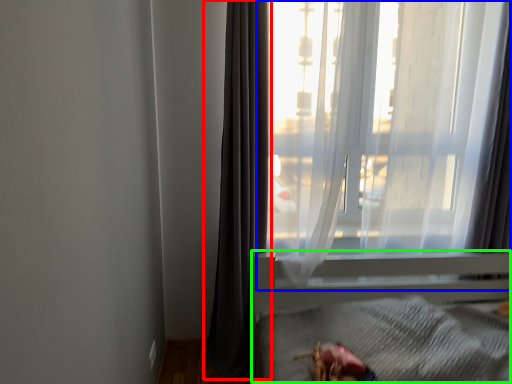
Question: Which object is the closest to the curtain (highlighted by a red box)? Choose among these: window (highlighted by a blue box) or bed frame (highlighted by a green box).

Choices:
 (A) window
 (B) bed frame

Answer: (A)